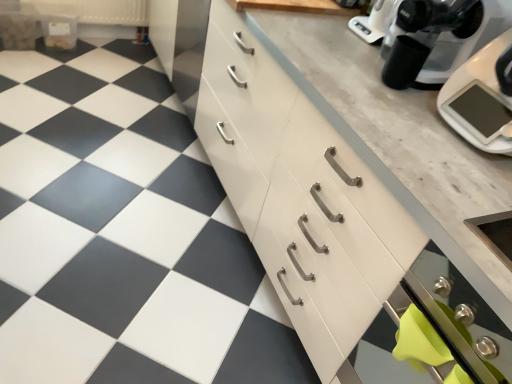
Find the location of a particular element. vacant area that is in front of white glossy cabinet at upper right, placed as the 1th cabinetry when sorted from top to bottom is located at coordinates (133, 99).